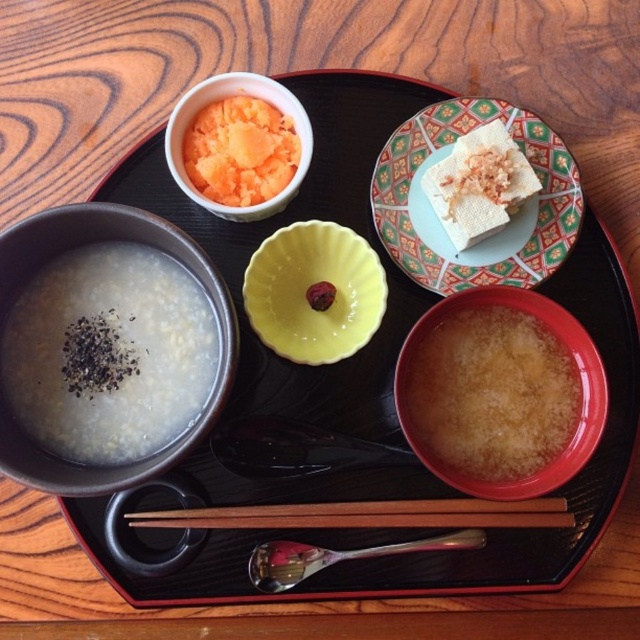
Between point (452, 205) and point (307, 132), which one is positioned behind?

The point (452, 205) is more distant.

Is white crumbly tofu at upper right below matte orange bowl at upper left?

Yes, white crumbly tofu at upper right is below matte orange bowl at upper left.

Is point (472, 186) positioned behind point (301, 166)?

Yes, it is.

At what (x,y) coordinates should I click in order to perform the action: click on white crumbly tofu at upper right. Please return your answer as a coordinate pair (x, y). Looking at the image, I should click on (477, 184).

Who is higher up, brown wood chopsticks at center or white crumbly tofu at upper right?

Positioned higher is white crumbly tofu at upper right.

Can you confirm if brown wood chopsticks at center is thinner than white crumbly tofu at upper right?

In fact, brown wood chopsticks at center might be wider than white crumbly tofu at upper right.

Locate an element on the screen. This screenshot has width=640, height=640. brown wood chopsticks at center is located at coordinates (368, 515).

The width and height of the screenshot is (640, 640). I want to click on brown wood chopsticks at center, so click(368, 515).

Identify the location of brown wood chopsticks at center. (368, 515).

Does brown wood chopsticks at center lie behind matte orange bowl at upper left?

That is True.

I want to click on brown wood chopsticks at center, so click(368, 515).